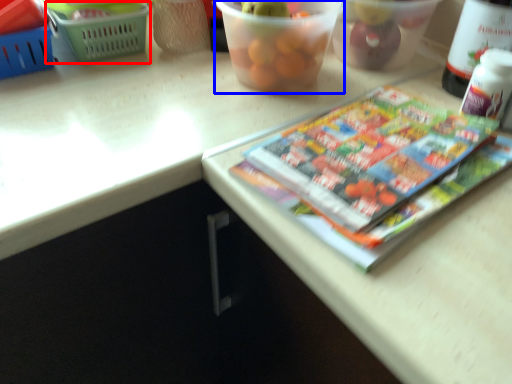
Question: Which object appears closest to the camera in this image, basket (highlighted by a red box) or glass bowl (highlighted by a blue box)?

Choices:
 (A) basket
 (B) glass bowl

Answer: (B)